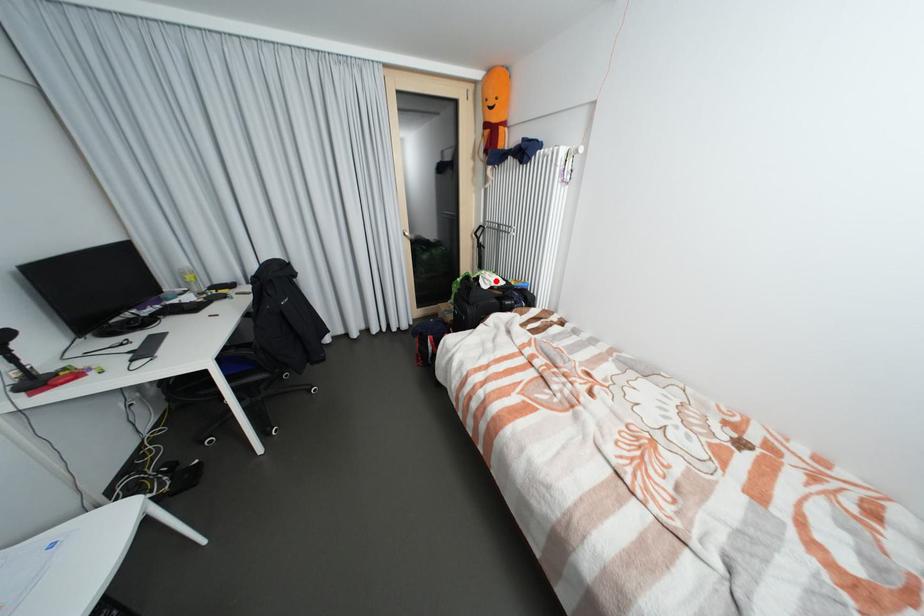
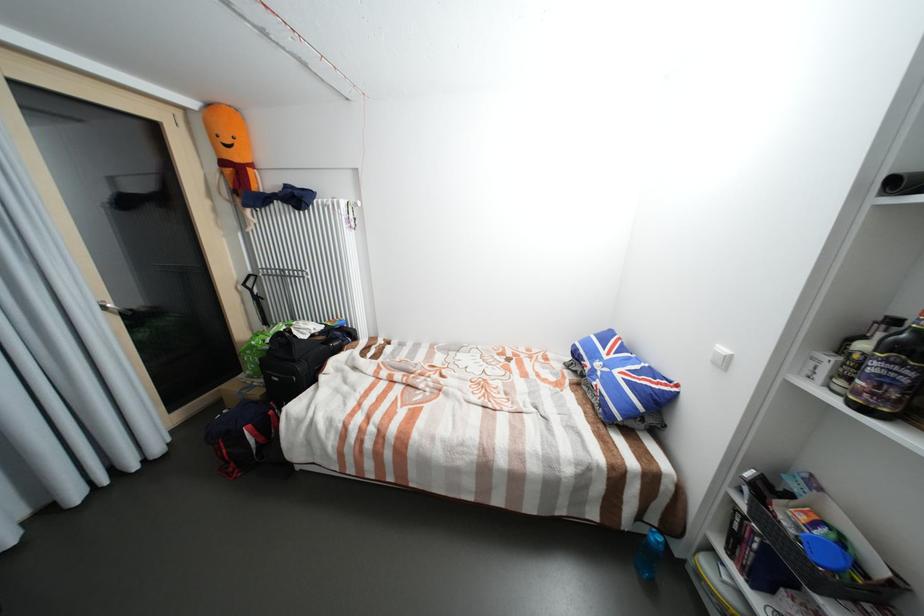
The point at the highlighted location is marked in the first image. Where is the corresponding point in the second image?

(313, 330)